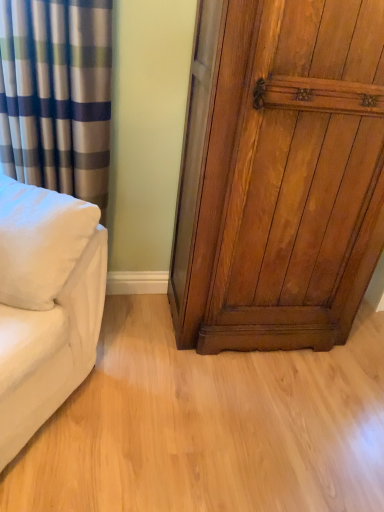
This screenshot has height=512, width=384. In order to click on free space above light wood floor at center (from a real-world perspective) in this screenshot , I will do `click(231, 398)`.